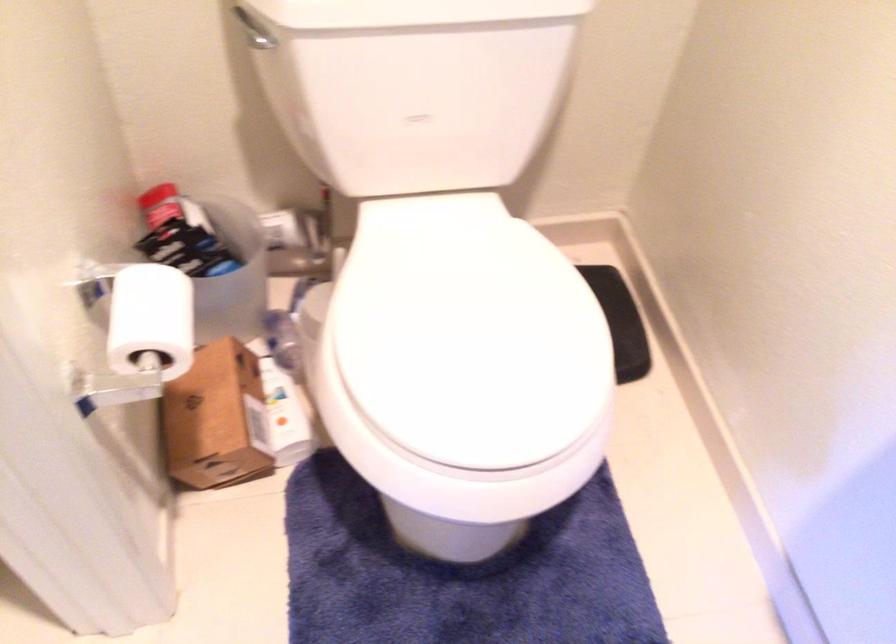
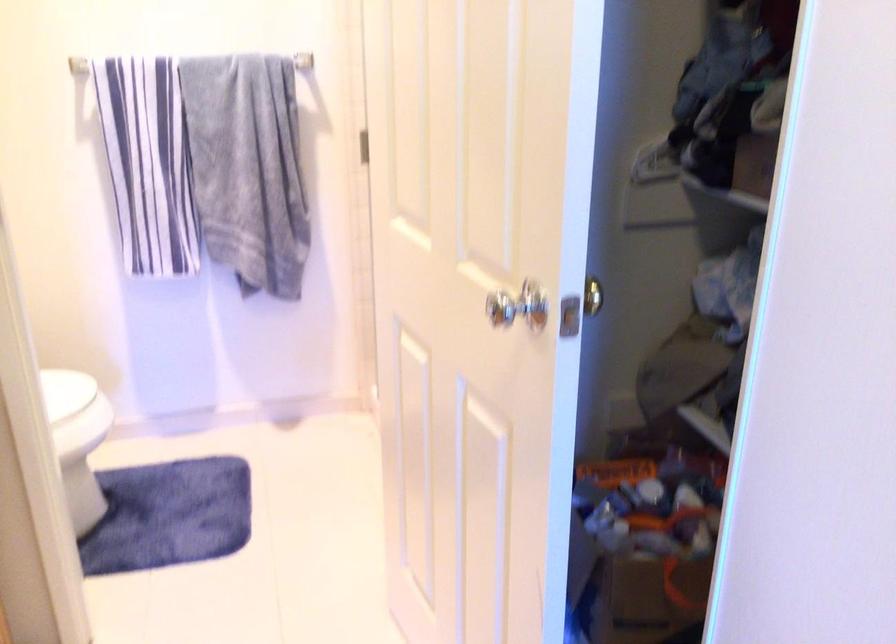
The point at (426, 422) is marked in the first image. Where is the corresponding point in the second image?

(72, 400)